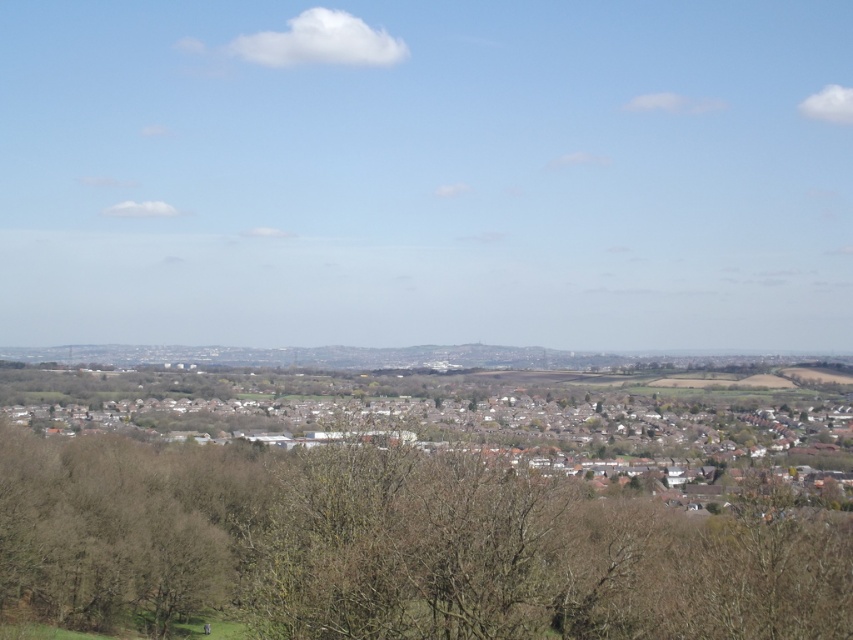
Does brown leafless tree at lower center appear over brown wooden houses at center?

No.

At what (x,y) coordinates should I click in order to perform the action: click on brown leafless tree at lower center. Please return your answer as a coordinate pair (x, y). Looking at the image, I should click on (396, 547).

In order to click on brown leafless tree at lower center in this screenshot , I will do `click(396, 547)`.